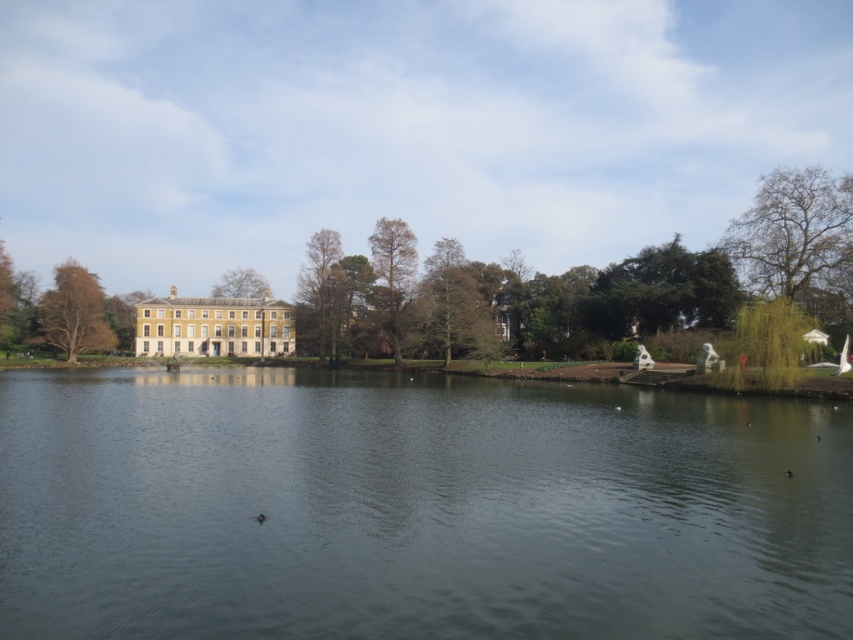
You are standing on a dock and looking at the dark gray water at center and the brown textured tree at upper center. Which object is positioned to the right of the other?

The dark gray water at center is to the right of brown textured tree at upper center.

You are standing at the point marked as point [415,508] in the image. What is the color of the surface you are currently standing on?

The surface at point [415,508] is dark gray water at center.

You are a surveyor measuring distances between landmarks. You have a drone that can fly 50 meters. You need to fly from the dark gray water at center to the green matte tree at center. Can your drone make the trip without needing to land?

The dark gray water at center is 56.15 meters from the green matte tree at center. Since the drone can only fly 50 meters, it cannot make the trip without needing to land.